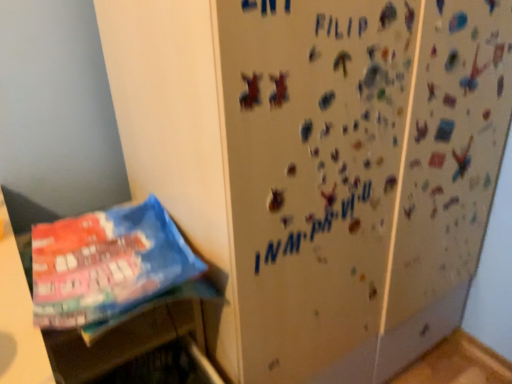
This screenshot has height=384, width=512. Describe the element at coordinates (106, 264) in the screenshot. I see `blue paper at left` at that location.

I want to click on blue paper at left, so click(106, 264).

Measure the distance between blue paper at left and camera.

27.64 inches.

Find the location of a particular element. This screenshot has height=384, width=512. blue paper at left is located at coordinates [106, 264].